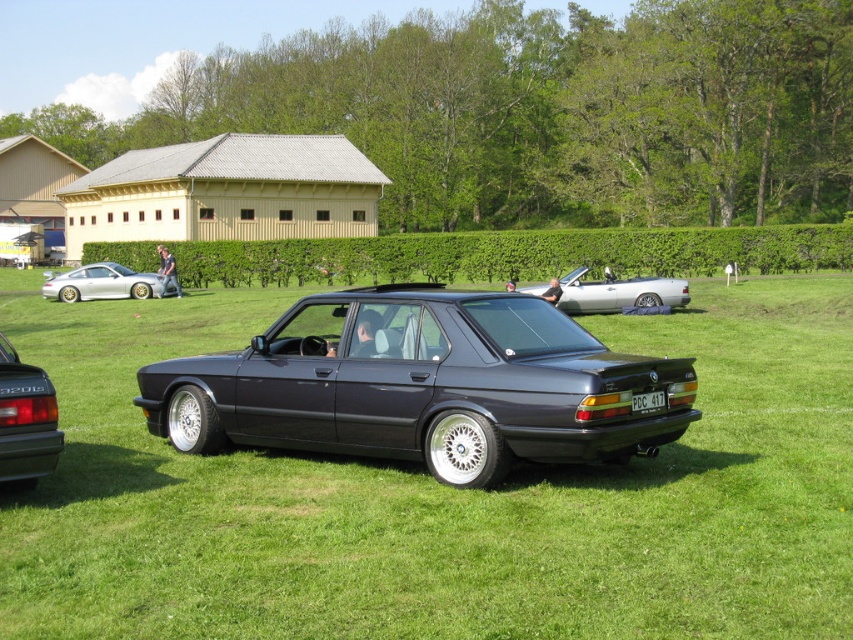
Does satin black sedan at center appear over white plastic license plate at center?

Incorrect, satin black sedan at center is not positioned above white plastic license plate at center.

What do you see at coordinates (422, 385) in the screenshot? I see `satin black sedan at center` at bounding box center [422, 385].

Describe the element at coordinates (422, 385) in the screenshot. The height and width of the screenshot is (640, 853). I see `satin black sedan at center` at that location.

Locate an element on the screen. satin black sedan at center is located at coordinates (422, 385).

Is point (93, 412) farther from viewer compared to point (405, 371)?

Yes.

Find the location of a particular element. The image size is (853, 640). green grass at center is located at coordinates (444, 497).

The width and height of the screenshot is (853, 640). I want to click on silver metallic convertible at center, so click(x=619, y=292).

The height and width of the screenshot is (640, 853). I want to click on silver metallic convertible at center, so click(619, 292).